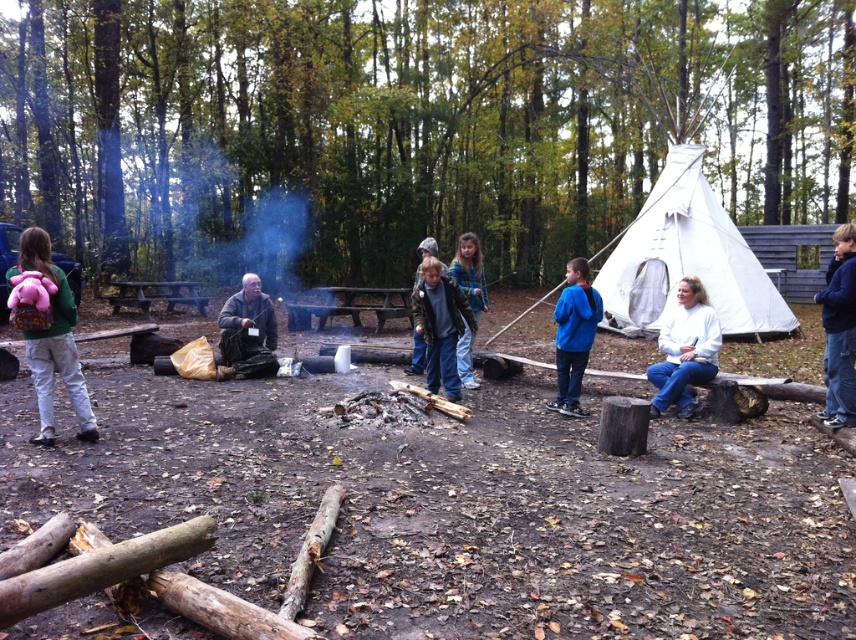
You are packing for a camping trip and have two jackets in your bag, the dark brown leather jacket at center and the blue fleece jacket at center. If you want to wear the wider jacket for warmth, which one should you choose?

The dark brown leather jacket at center is wider than the blue fleece jacket at center, so you should choose the dark brown leather jacket at center for more warmth.

Consider the image. You are standing at the center of the campsite and want to retrieve your pink fabric backpack at left. Which direction should you move to reach it?

The pink fabric backpack at left is located at point (x=49, y=333) in 2D coordinates, so you should move to the left to reach it.